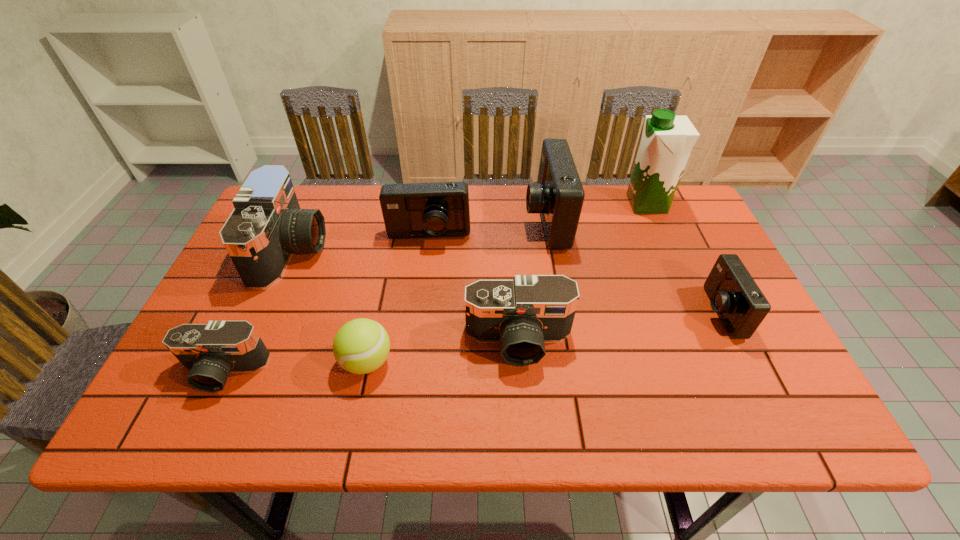
In order to click on empty space between the leftmost blue camera and the smallest black camera in this screenshot , I will do `click(325, 304)`.

The image size is (960, 540). Find the location of `blank region between the green soya milk and the leftmost blue camera`. blank region between the green soya milk and the leftmost blue camera is located at coordinates (538, 220).

The width and height of the screenshot is (960, 540). Identify the location of vacant point located between the tallest object and the biggest blue camera. (596, 212).

Identify which object is the seventh closest to the farthest black camera. Please provide its 2D coordinates. Your answer should be formatted as a tuple, i.e. [(x, y)], where the tuple contains the x and y coordinates of a point satisfying the conditions above.

[(734, 295)]

Identify which object is the fifth nearest to the smallest blue camera. Please provide its 2D coordinates. Your answer should be formatted as a tuple, i.e. [(x, y)], where the tuple contains the x and y coordinates of a point satisfying the conditions above.

[(362, 345)]

I want to click on camera that is the sixth closest one to the soya milk, so click(211, 351).

Choose which camera is the second nearest neighbor to the smallest blue camera. Please provide its 2D coordinates. Your answer should be formatted as a tuple, i.e. [(x, y)], where the tuple contains the x and y coordinates of a point satisfying the conditions above.

[(522, 314)]

Point out which blue camera is positioned as the second nearest to the tennis ball. Please provide its 2D coordinates. Your answer should be formatted as a tuple, i.e. [(x, y)], where the tuple contains the x and y coordinates of a point satisfying the conditions above.

[(558, 196)]

You are a GUI agent. You are given a task and a screenshot of the screen. Output one action in this format:
    pyautogui.click(x=<x>, y=<y>)
    Task: Click on the third closest blue camera to the farthest black camera
    This screenshot has width=960, height=540.
    Given the screenshot: What is the action you would take?
    pyautogui.click(x=734, y=295)

Identify the location of black camera that is the closest to the rightmost blue camera. This screenshot has width=960, height=540. tap(522, 314).